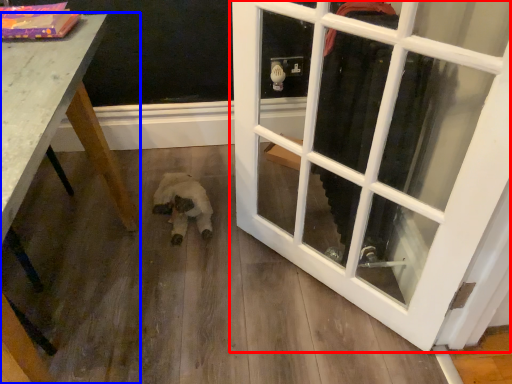
Question: Which object appears closest to the camera in this image, door (highlighted by a red box) or table (highlighted by a blue box)?

Choices:
 (A) door
 (B) table

Answer: (B)